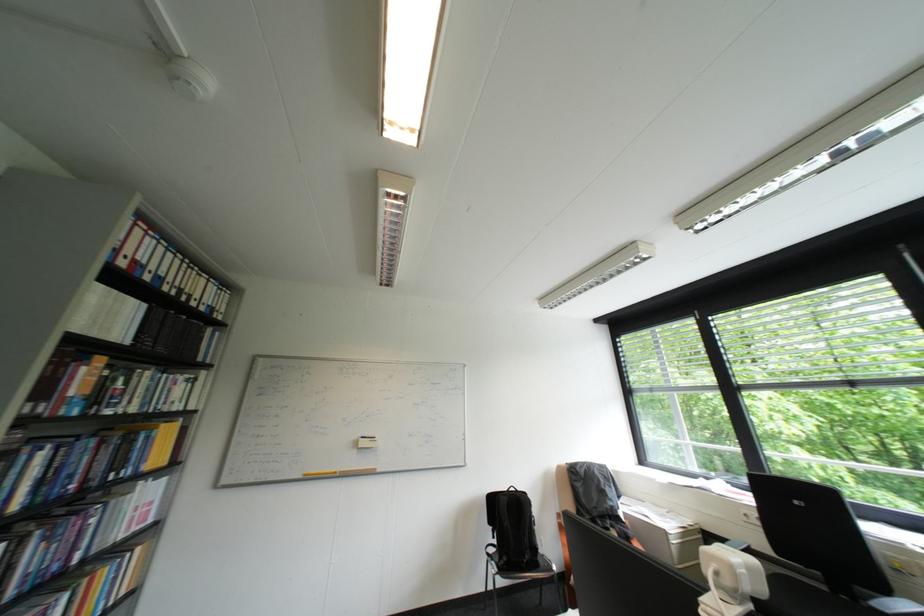
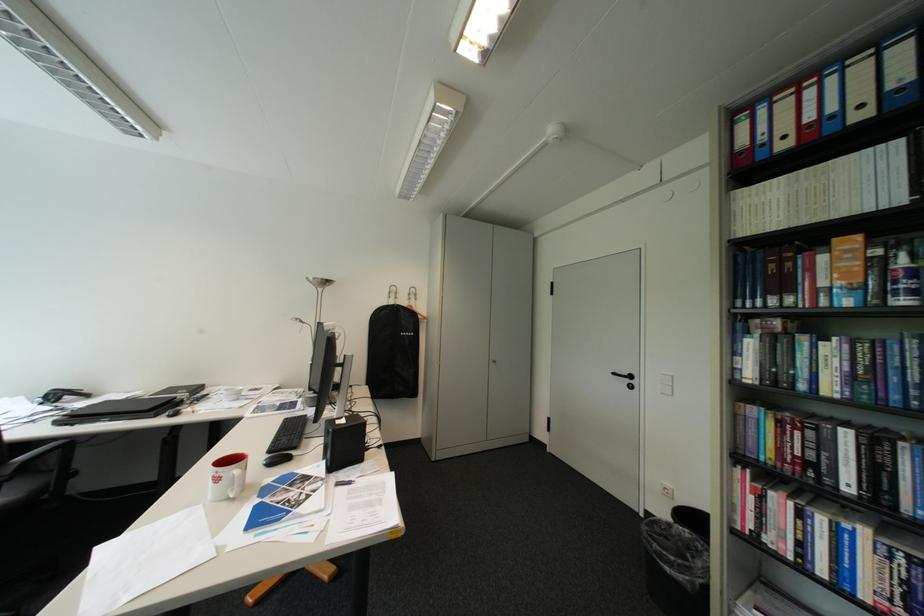
The point at (124, 399) is marked in the first image. Where is the corresponding point in the second image?

(907, 284)